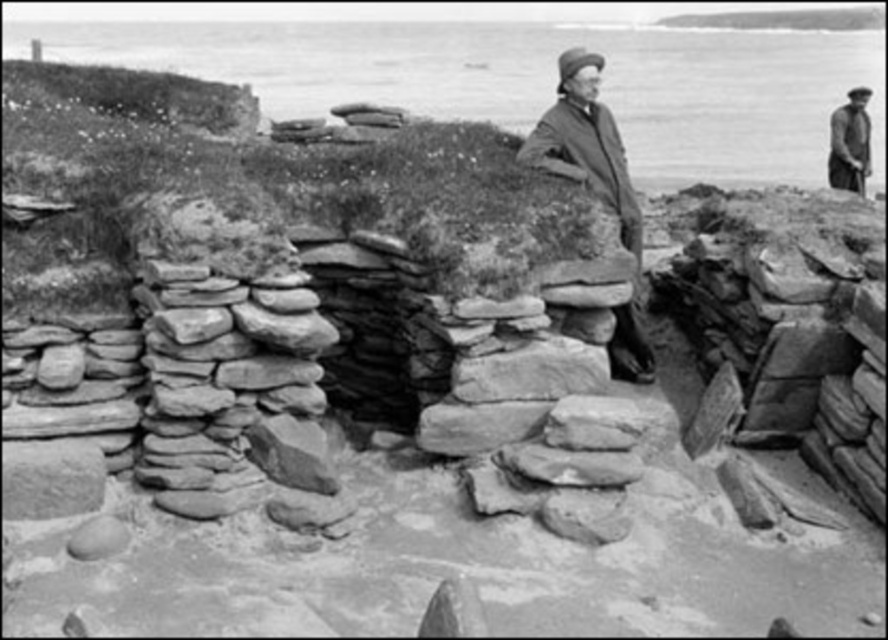
Question: Where is smooth woolen coat at center located in relation to smooth rock at center in the image?

Choices:
 (A) below
 (B) above

Answer: (B)

Question: Which of the following is the closest to the observer?

Choices:
 (A) (532, 372)
 (B) (591, 118)
 (C) (284, 420)

Answer: (C)

Question: Which object is farther from the camera taking this photo?

Choices:
 (A) smooth stone wall at center
 (B) smooth dark fabric coat at upper right
 (C) smooth gray rock at center
 (D) smooth woolen coat at center

Answer: (B)

Question: Estimate the real-world distances between objects in this image. Which object is closer to the smooth rock at center?

Choices:
 (A) smooth gray rock at center
 (B) smooth dark fabric coat at upper right
 (C) smooth woolen coat at center
 (D) smooth stone wall at center

Answer: (A)

Question: Does smooth rock at center appear under smooth gray rock at center?

Choices:
 (A) no
 (B) yes

Answer: (A)

Question: Is smooth stone wall at center closer to the viewer compared to smooth dark fabric coat at upper right?

Choices:
 (A) no
 (B) yes

Answer: (B)